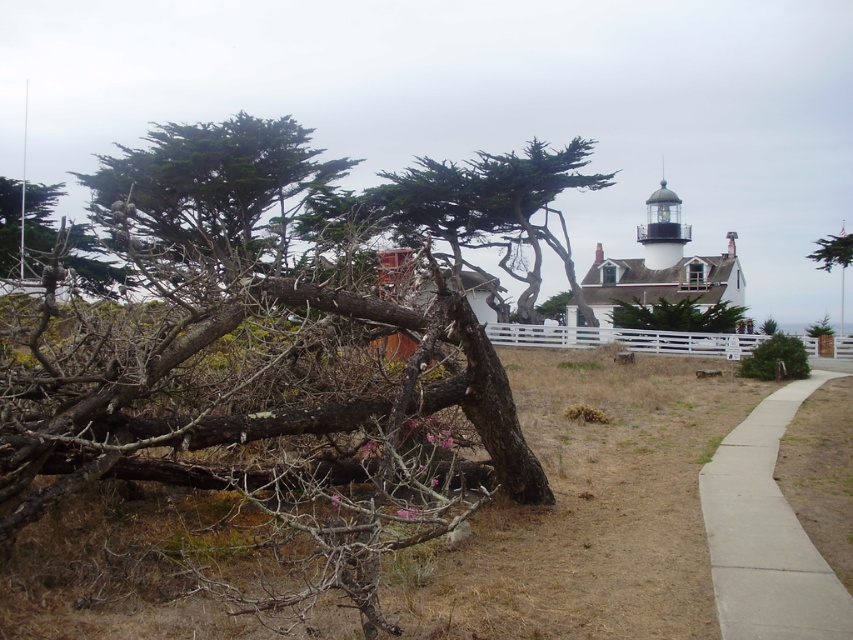
Is brown rough bark tree at left closer to the viewer compared to green matte tree at center?

Yes, brown rough bark tree at left is closer to the viewer.

Does brown rough bark tree at left appear over green matte tree at center?

No.

Locate an element on the screen. Image resolution: width=853 pixels, height=640 pixels. brown rough bark tree at left is located at coordinates (265, 426).

Can you confirm if brown rough bark tree at left is taller than green needle-like foliage at upper left?

No, brown rough bark tree at left is not taller than green needle-like foliage at upper left.

Which is behind, point (248, 493) or point (196, 132)?

The point (196, 132) is behind.

Who is more distant from viewer, (453, 525) or (357, 161)?

Positioned behind is point (357, 161).

Where is `brown rough bark tree at left`? brown rough bark tree at left is located at coordinates (265, 426).

Does green needle-like foliage at upper left appear under concrete sidewalk at lower right?

No, green needle-like foliage at upper left is not below concrete sidewalk at lower right.

Who is lower down, green needle-like foliage at upper left or concrete sidewalk at lower right?

Positioned lower is concrete sidewalk at lower right.

Identify the location of green needle-like foliage at upper left. This screenshot has height=640, width=853. (212, 193).